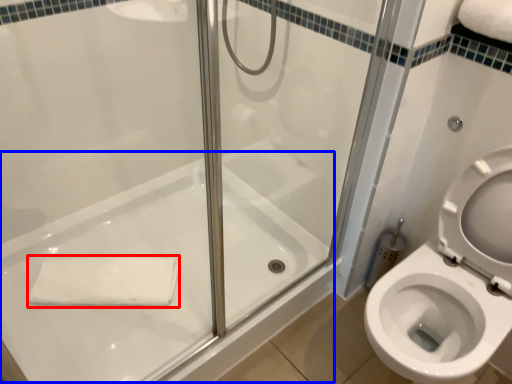
Question: Which object appears closest to the camera in this image, bath towel (highlighted by a red box) or bath (highlighted by a blue box)?

Choices:
 (A) bath towel
 (B) bath

Answer: (B)